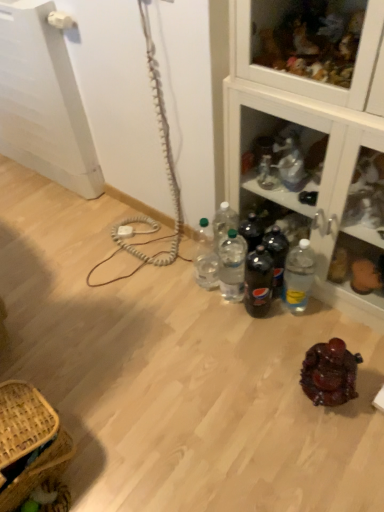
Where is `free spot in front of clear plastic bottles at center, the first bottle in the left-to-right sequence`? The width and height of the screenshot is (384, 512). free spot in front of clear plastic bottles at center, the first bottle in the left-to-right sequence is located at coordinates pyautogui.click(x=213, y=315).